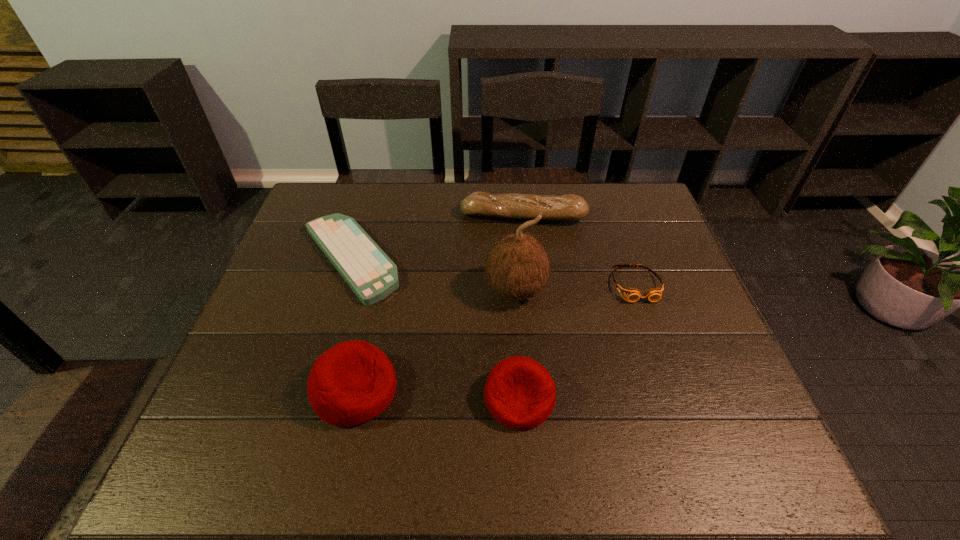
I want to click on the left beanbag, so click(x=353, y=382).

Locate an element on the screen. Image resolution: width=960 pixels, height=540 pixels. the second tallest object is located at coordinates point(353,382).

I want to click on the shorter beanbag, so click(x=520, y=394).

Identify the location of coconut. The width and height of the screenshot is (960, 540). (518, 267).

The width and height of the screenshot is (960, 540). What are the coordinates of `baguet` in the screenshot? It's located at (511, 205).

You are a GUI agent. You are given a task and a screenshot of the screen. Output one action in this format:
    pyautogui.click(x=<x>, y=<y>)
    Task: Click on the shortest object
    Image resolution: width=960 pixels, height=540 pixels.
    Given the screenshot: What is the action you would take?
    pyautogui.click(x=371, y=274)

Locate an element on the screen. The height and width of the screenshot is (540, 960). the fifth tallest object is located at coordinates (632, 294).

This screenshot has width=960, height=540. What are the coordinates of `the rightmost object` in the screenshot? It's located at (632, 294).

Locate an element on the screen. vacant region located 0.270m on the seat area of the left beanbag is located at coordinates (521, 390).

The image size is (960, 540). Find the location of `free space located 0.270m on the surface of the tallest object`. free space located 0.270m on the surface of the tallest object is located at coordinates (525, 415).